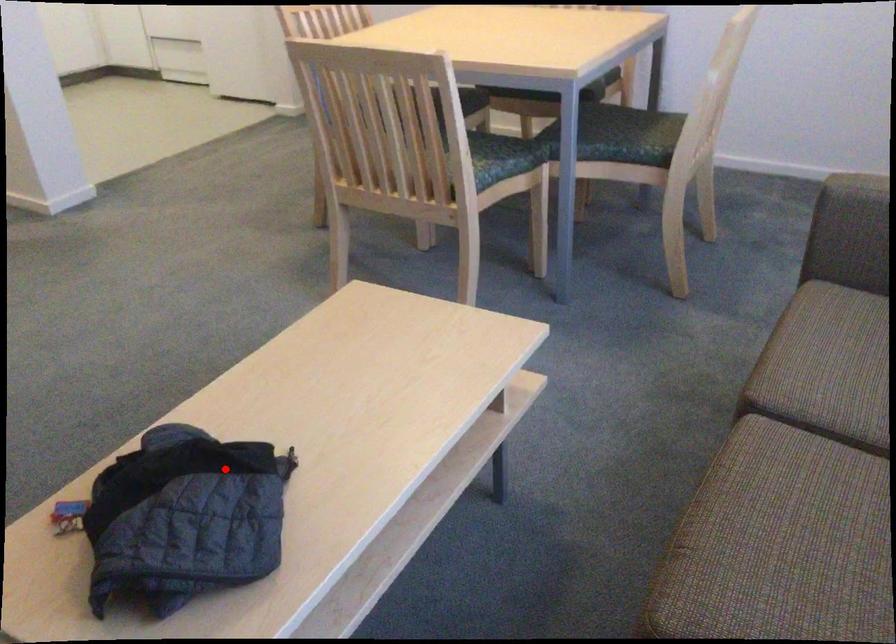
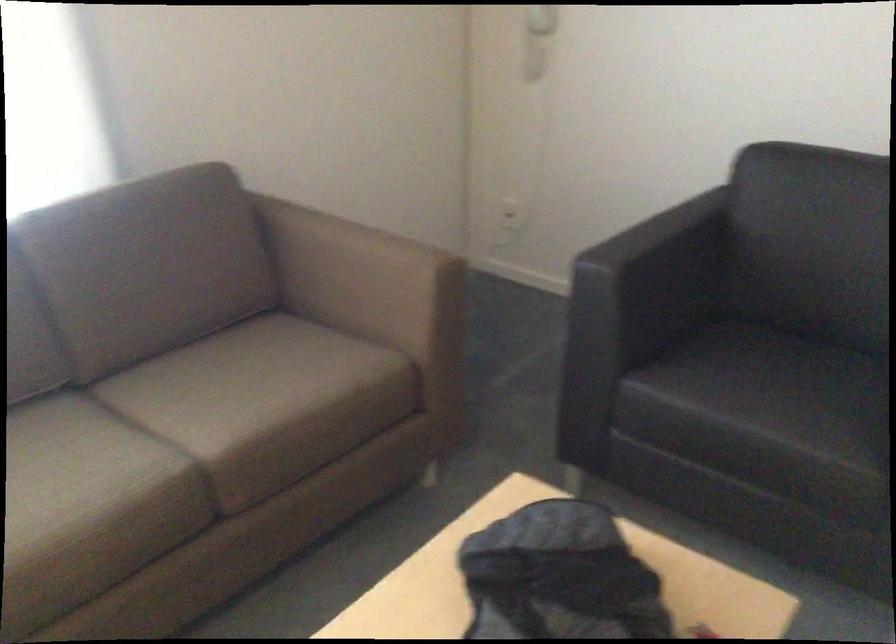
Where in the second image is the point corresponding to the highlighted location from the first image?

(558, 576)